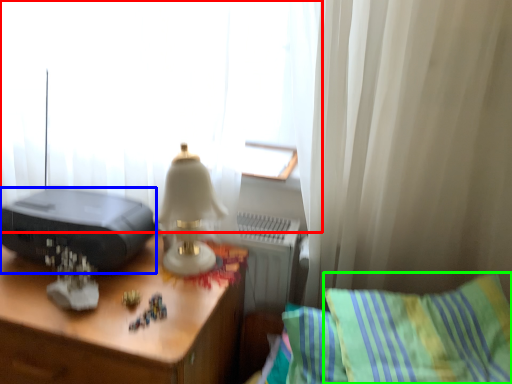
Question: Considering the real-world distances, which object is closest to curtain (highlighted by a red box)? printer (highlighted by a blue box) or pillow (highlighted by a green box).

Choices:
 (A) printer
 (B) pillow

Answer: (A)